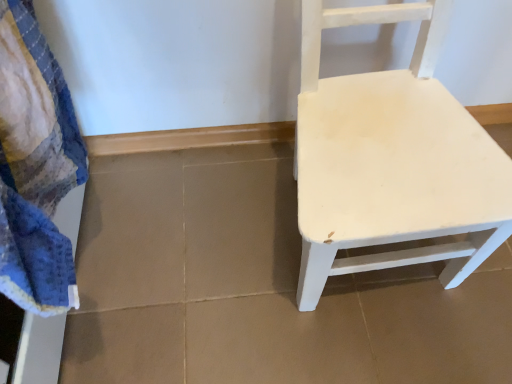
This screenshot has width=512, height=384. Describe the element at coordinates (35, 166) in the screenshot. I see `blue textured bath towel at left` at that location.

At what (x,y) coordinates should I click in order to perform the action: click on blue textured bath towel at left. Please return your answer as a coordinate pair (x, y). Looking at the image, I should click on (35, 166).

What do you see at coordinates (391, 160) in the screenshot? Image resolution: width=512 pixels, height=384 pixels. I see `white matte chair at right` at bounding box center [391, 160].

What is the approximate height of white matte chair at right?

white matte chair at right is 20.77 inches tall.

The image size is (512, 384). Identify the location of white matte chair at right. (391, 160).

This screenshot has height=384, width=512. What are the coordinates of `blue textured bath towel at left` in the screenshot? It's located at (35, 166).

Which is more to the left, white matte chair at right or blue textured bath towel at left?

blue textured bath towel at left.

Based on the photo, in the image, is white matte chair at right positioned in front of or behind blue textured bath towel at left?

Visually, white matte chair at right is located behind blue textured bath towel at left.

Is point (409, 112) behind point (24, 207)?

Yes, point (409, 112) is behind point (24, 207).

From the image's perspective, is white matte chair at right located beneath blue textured bath towel at left?

No, from the image's perspective, white matte chair at right is not below blue textured bath towel at left.

From a real-world perspective, between white matte chair at right and blue textured bath towel at left, who is vertically higher?

blue textured bath towel at left, from a real-world perspective.

In terms of width, does white matte chair at right look wider or thinner when compared to blue textured bath towel at left?

white matte chair at right is wider than blue textured bath towel at left.

Considering the relative sizes of white matte chair at right and blue textured bath towel at left in the image provided, is white matte chair at right shorter than blue textured bath towel at left?

Incorrect, the height of white matte chair at right does not fall short of that of blue textured bath towel at left.

Considering the sizes of white matte chair at right and blue textured bath towel at left in the image, is white matte chair at right bigger or smaller than blue textured bath towel at left?

white matte chair at right is bigger than blue textured bath towel at left.

Is white matte chair at right located outside blue textured bath towel at left?

white matte chair at right lies outside blue textured bath towel at left's area.

Based on the photo, is white matte chair at right placed right next to blue textured bath towel at left?

white matte chair at right and blue textured bath towel at left are not in contact.

Is white matte chair at right oriented towards blue textured bath towel at left?

No, white matte chair at right is not aimed at blue textured bath towel at left.

What's the angular difference between white matte chair at right and blue textured bath towel at left's facing directions?

white matte chair at right and blue textured bath towel at left are facing 91 degrees away from each other.

Locate an element on the screen. chair that is above the blue textured bath towel at left (from the image's perspective) is located at coordinates (391, 160).

Which is more to the right, blue textured bath towel at left or white matte chair at right?

white matte chair at right is more to the right.

Is blue textured bath towel at left in front of or behind white matte chair at right in the image?

blue textured bath towel at left is in front of white matte chair at right.

Does point (31, 138) appear closer or farther from the camera than point (367, 174)?

Clearly, point (31, 138) is closer to the camera than point (367, 174).

From the image's perspective, is blue textured bath towel at left over white matte chair at right?

No, from the image's perspective, blue textured bath towel at left is not on top of white matte chair at right.

From a real-world perspective, relative to white matte chair at right, is blue textured bath towel at left vertically above or below?

Clearly, from a real-world perspective, blue textured bath towel at left is above white matte chair at right.

Considering the sizes of objects blue textured bath towel at left and white matte chair at right in the image provided, who is thinner, blue textured bath towel at left or white matte chair at right?

Thinner between the two is blue textured bath towel at left.

Considering the relative sizes of blue textured bath towel at left and white matte chair at right in the image provided, is blue textured bath towel at left taller than white matte chair at right?

No, blue textured bath towel at left is not taller than white matte chair at right.

Considering the sizes of objects blue textured bath towel at left and white matte chair at right in the image provided, who is bigger, blue textured bath towel at left or white matte chair at right?

With larger size is white matte chair at right.

Is blue textured bath towel at left located outside white matte chair at right?

Absolutely, blue textured bath towel at left is external to white matte chair at right.

Is blue textured bath towel at left not near white matte chair at right?

Actually, blue textured bath towel at left and white matte chair at right are a little close together.

Is blue textured bath towel at left facing towards white matte chair at right?

Yes.

How much distance is there between blue textured bath towel at left and white matte chair at right?

15.48 inches.

Where is `bath towel that appears below the white matte chair at right (from the image's perspective)`? This screenshot has width=512, height=384. bath towel that appears below the white matte chair at right (from the image's perspective) is located at coordinates (35, 166).

This screenshot has height=384, width=512. In order to click on chair to the right of blue textured bath towel at left in this screenshot , I will do `click(391, 160)`.

At what (x,y) coordinates should I click in order to perform the action: click on bath towel on the left side of white matte chair at right. Please return your answer as a coordinate pair (x, y). Looking at the image, I should click on (35, 166).